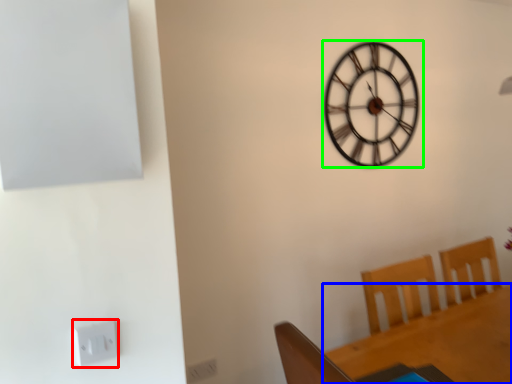
Question: Estimate the real-world distances between objects in this image. Which object is farther from electric outlet (highlighted by a red box), round table (highlighted by a blue box) or wall clock (highlighted by a green box)?

Choices:
 (A) round table
 (B) wall clock

Answer: (B)